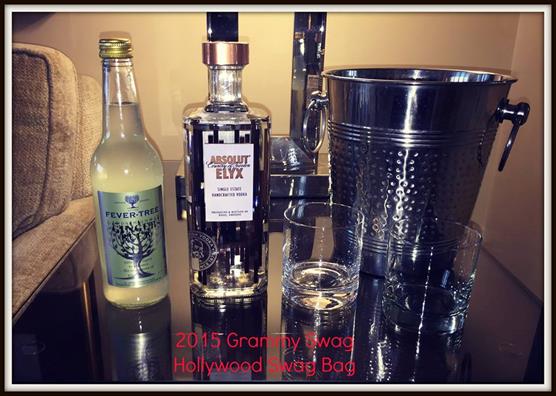
Image resolution: width=556 pixels, height=396 pixels. What are the coordinates of `absolute elyx vodka bottle` in the screenshot? It's located at (228, 245).